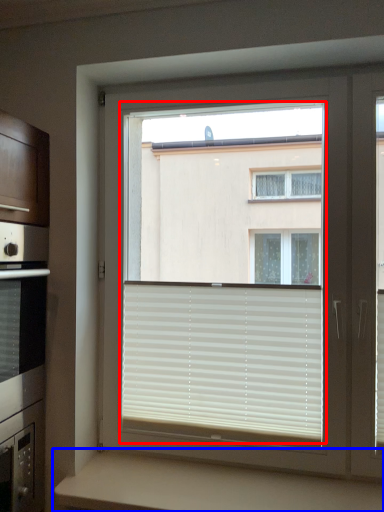
Question: Which object appears closest to the camera in this image, bay window (highlighted by a red box) or counter (highlighted by a blue box)?

Choices:
 (A) bay window
 (B) counter

Answer: (B)